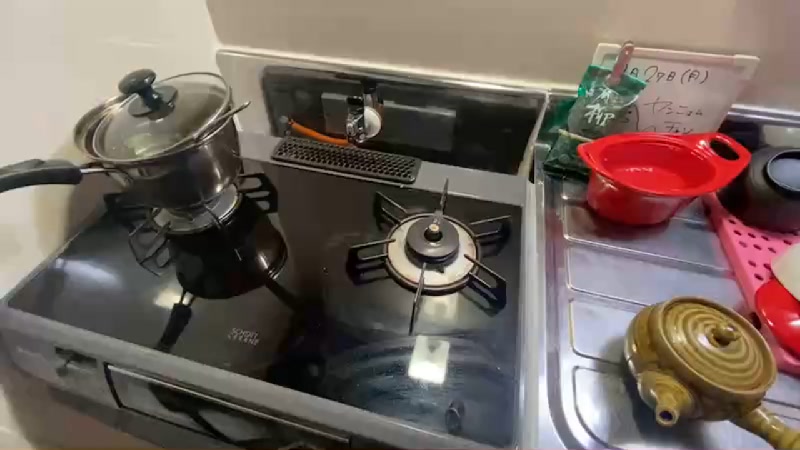
Identify the location of reflection of ceiling lights in stovetop. Image resolution: width=800 pixels, height=450 pixels. (88, 275), (165, 297), (422, 364), (444, 301).